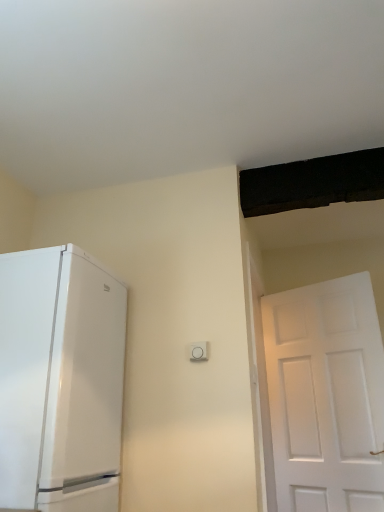
Question: From a real-world perspective, relative to white plastic light switch at center, is white glossy refrigerator at left vertically above or below?

Choices:
 (A) below
 (B) above

Answer: (A)

Question: Looking at their shapes, would you say white glossy refrigerator at left is wider or thinner than white plastic light switch at center?

Choices:
 (A) thin
 (B) wide

Answer: (B)

Question: Is white glossy refrigerator at left in front of or behind white plastic light switch at center in the image?

Choices:
 (A) front
 (B) behind

Answer: (A)

Question: Is white plastic light switch at center in front of or behind white glossy refrigerator at left in the image?

Choices:
 (A) behind
 (B) front

Answer: (A)

Question: Choose the correct answer: Is white plastic light switch at center inside white glossy refrigerator at left or outside it?

Choices:
 (A) outside
 (B) inside

Answer: (A)

Question: Is white plastic light switch at center to the left or to the right of white glossy refrigerator at left in the image?

Choices:
 (A) right
 (B) left

Answer: (A)

Question: Looking at their shapes, would you say white plastic light switch at center is wider or thinner than white glossy refrigerator at left?

Choices:
 (A) wide
 (B) thin

Answer: (B)